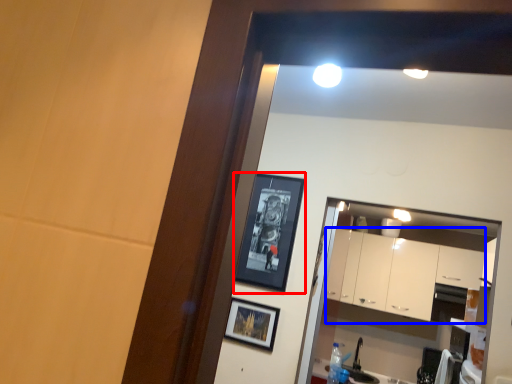
Question: Which object appears closest to the camera in this image, picture frame (highlighted by a red box) or cabinetry (highlighted by a blue box)?

Choices:
 (A) picture frame
 (B) cabinetry

Answer: (A)